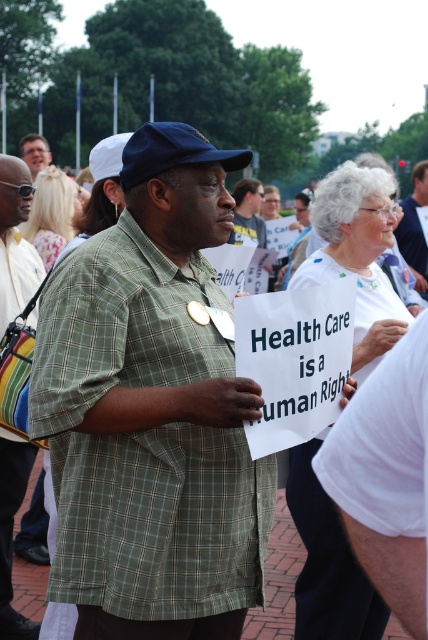
You are a photographer at the rally and need to capture a closeup of the green plaid shirt at center without the multicolored striped bag at left blocking the view. Is the bag too large to avoid?

The multicolored striped bag at left is bigger than green plaid shirt at center, so it might block the view. Move to the right to avoid the bag.

You are a photographer at the rally and want to capture a photo of the green plaid shirt at center without the multicolored striped bag at left overlapping it. Is the bag too wide to block the shirt in the frame?

The multicolored striped bag at left is thinner than the green plaid shirt at center, so it is not too wide to block the shirt. However, the bag might still partially overlap depending on their positions.

You are organizing a protest and need to carry both the multicolored striped bag at left and the matte black sign at center. Which item can you fit into a standard backpack with a 20L capacity without overstuffing?

The multicolored striped bag at left has a smaller size compared to matte black sign at center, so it can fit into the standard backpack with a 20L capacity without overstuffing.